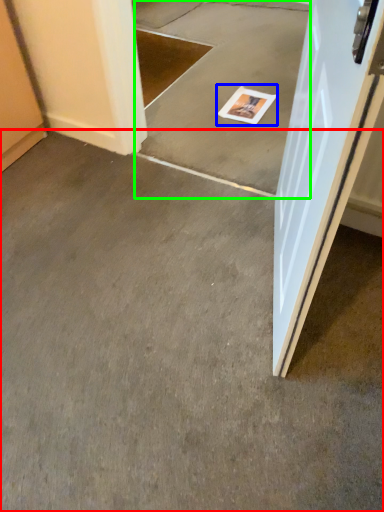
Question: Estimate the real-world distances between objects in this image. Which object is closer to concrete (highlighted by a red box), magazine (highlighted by a blue box) or concrete (highlighted by a green box)?

Choices:
 (A) magazine
 (B) concrete

Answer: (B)